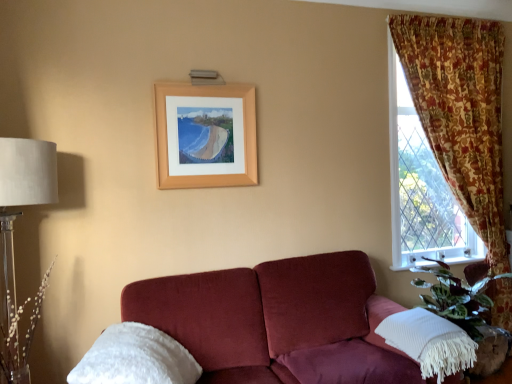
Question: Can you confirm if white fluffy pillow at lower left, marked as the 2th pillow in a right-to-left arrangement, is shorter than floral fabric curtain at right?

Choices:
 (A) no
 (B) yes

Answer: (B)

Question: From the image's perspective, is white fluffy pillow at lower left, which appears as the 1th pillow when viewed from the left, on top of floral fabric curtain at right?

Choices:
 (A) no
 (B) yes

Answer: (A)

Question: Is white fluffy pillow at lower left, marked as the 2th pillow in a right-to-left arrangement, thinner than floral fabric curtain at right?

Choices:
 (A) no
 (B) yes

Answer: (A)

Question: Are white fluffy pillow at lower left, which appears as the 1th pillow when viewed from the left, and floral fabric curtain at right far apart?

Choices:
 (A) yes
 (B) no

Answer: (A)

Question: Considering the relative positions of white fluffy pillow at lower left, which appears as the 1th pillow when viewed from the left, and floral fabric curtain at right in the image provided, is white fluffy pillow at lower left, which appears as the 1th pillow when viewed from the left, to the left of floral fabric curtain at right from the viewer's perspective?

Choices:
 (A) no
 (B) yes

Answer: (B)

Question: Is floral fabric curtain at right wider or thinner than wooden frame at upper center?

Choices:
 (A) thin
 (B) wide

Answer: (B)

Question: Is floral fabric curtain at right in front of or behind wooden frame at upper center in the image?

Choices:
 (A) front
 (B) behind

Answer: (B)

Question: Is floral fabric curtain at right to the left or to the right of wooden frame at upper center in the image?

Choices:
 (A) left
 (B) right

Answer: (B)

Question: From the image's perspective, is floral fabric curtain at right above or below wooden frame at upper center?

Choices:
 (A) below
 (B) above

Answer: (A)

Question: Based on their positions, is white fluffy pillow at lower left, which appears as the 1th pillow when viewed from the left, located to the left or right of translucent glass table lamp at left?

Choices:
 (A) right
 (B) left

Answer: (A)

Question: Does point (172, 372) appear closer or farther from the camera than point (22, 183)?

Choices:
 (A) farther
 (B) closer

Answer: (B)

Question: Relative to translucent glass table lamp at left, is white fluffy pillow at lower left, which appears as the 1th pillow when viewed from the left, in front or behind?

Choices:
 (A) behind
 (B) front

Answer: (B)

Question: From the image's perspective, is white fluffy pillow at lower left, marked as the 2th pillow in a right-to-left arrangement, located above or below translucent glass table lamp at left?

Choices:
 (A) below
 (B) above

Answer: (A)

Question: Choose the correct answer: Is wooden frame at upper center inside white plastic at lower right or outside it?

Choices:
 (A) outside
 (B) inside

Answer: (A)

Question: Is wooden frame at upper center bigger or smaller than white plastic at lower right?

Choices:
 (A) big
 (B) small

Answer: (A)